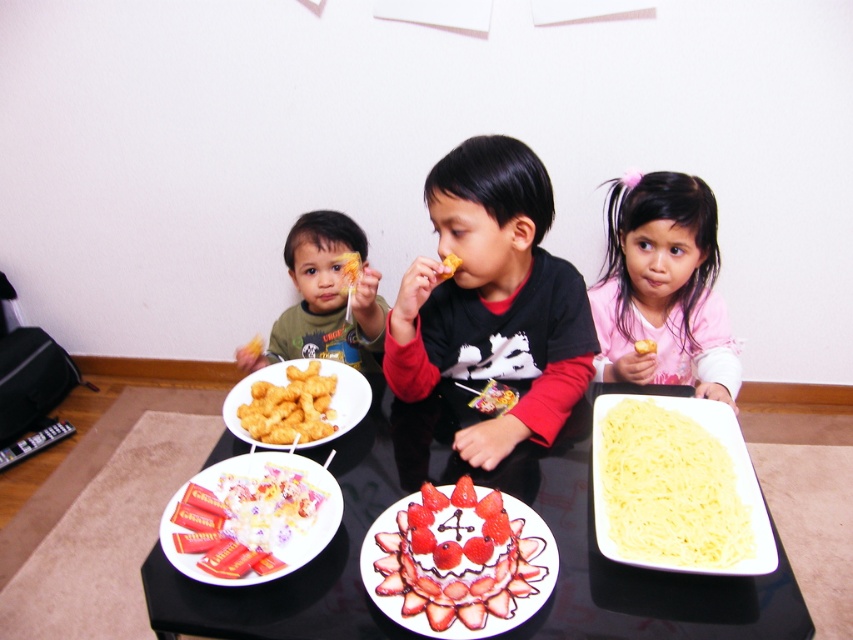
Question: Based on their relative distances, which object is farther from the pink fabric shirt at upper right?

Choices:
 (A) black matte shirt at center
 (B) yellow pasta at lower right
 (C) yellow matte pasta at center
 (D) smooth white plate with strawberries at center

Answer: (D)

Question: Which of the following is the farthest from the observer?

Choices:
 (A) click(x=531, y=614)
 (B) click(x=299, y=509)

Answer: (B)

Question: Does yellow pasta at lower right appear on the left side of matte yellow snack at left?

Choices:
 (A) no
 (B) yes

Answer: (A)

Question: Which of these objects is positioned farthest from the yellow pasta at lower right?

Choices:
 (A) pink fabric shirt at upper right
 (B) black matte shirt at center
 (C) golden crispy nuggets at center

Answer: (C)

Question: Can you confirm if black matte shirt at center is bigger than shiny plastic plate at center?

Choices:
 (A) no
 (B) yes

Answer: (B)

Question: From the image, what is the correct spatial relationship of yellow pasta at lower right in relation to shiny plastic plate at center?

Choices:
 (A) below
 (B) above

Answer: (B)